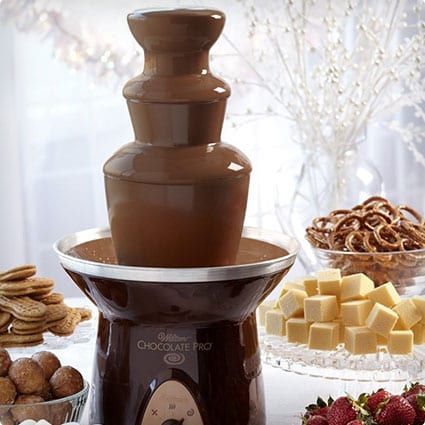
Image resolution: width=425 pixels, height=425 pixels. Find the location of `round chocolates bowl`. round chocolates bowl is located at coordinates (42, 406).